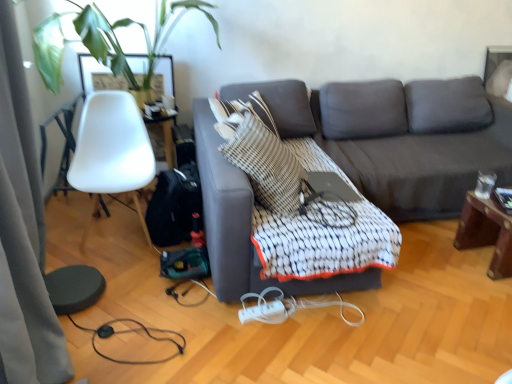
Identify the location of free area in between mahogany wood side table at right and white plastic cable at lower center, which is counted as the second cable, starting from the left. (426, 285).